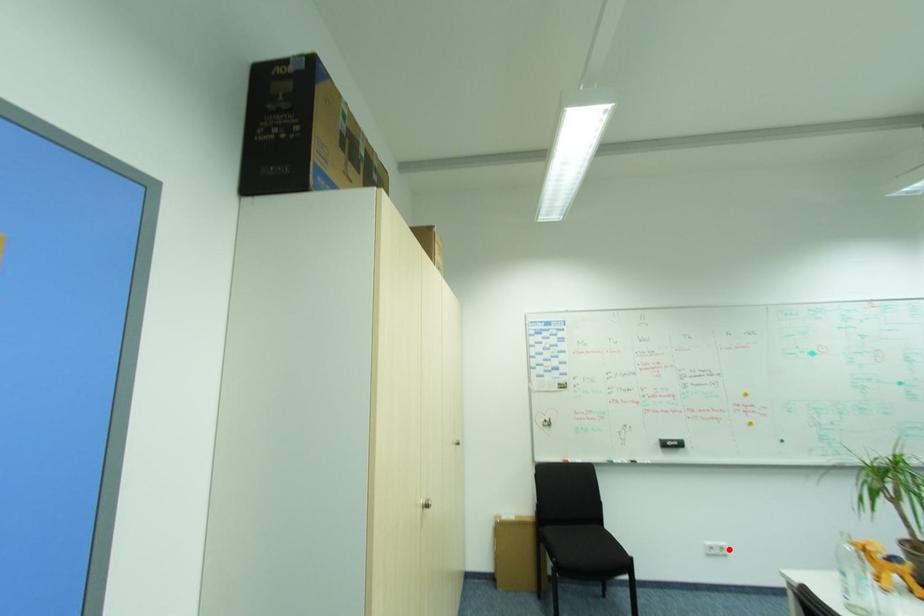
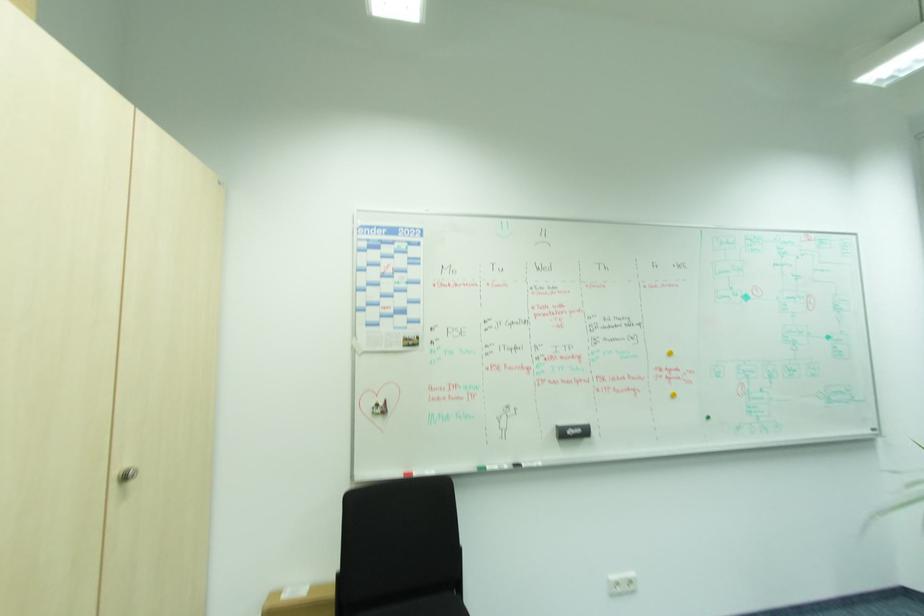
Locate, in the second image, the point that corresponds to the highlighted location in the first image.

(635, 578)